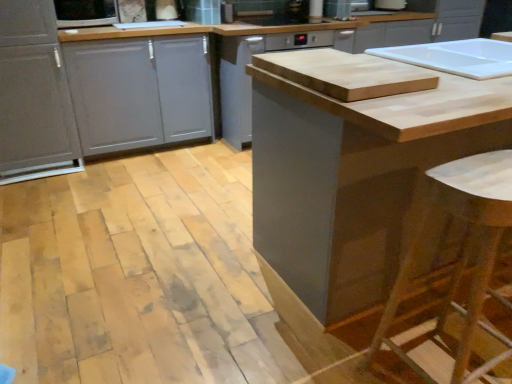
Question: Does wooden bar stool at lower right have a greater height compared to matte gray cabinet at center, which ranks as the 1th cabinetry in right-to-left order?

Choices:
 (A) no
 (B) yes

Answer: (A)

Question: Is the depth of wooden bar stool at lower right less than that of matte gray cabinet at center, which ranks as the 1th cabinetry in right-to-left order?

Choices:
 (A) no
 (B) yes

Answer: (B)

Question: Does wooden bar stool at lower right appear on the left side of matte gray cabinet at center, which ranks as the 1th cabinetry in right-to-left order?

Choices:
 (A) no
 (B) yes

Answer: (B)

Question: Considering the relative sizes of wooden bar stool at lower right and matte gray cabinet at center, which ranks as the 1th cabinetry in right-to-left order, in the image provided, is wooden bar stool at lower right smaller than matte gray cabinet at center, which ranks as the 1th cabinetry in right-to-left order,?

Choices:
 (A) yes
 (B) no

Answer: (A)

Question: Is wooden bar stool at lower right next to matte gray cabinet at center, which ranks as the 1th cabinetry in right-to-left order, and touching it?

Choices:
 (A) yes
 (B) no

Answer: (B)

Question: Is wooden bar stool at lower right oriented away from matte gray cabinet at center, the third cabinetry viewed from the left?

Choices:
 (A) yes
 (B) no

Answer: (B)

Question: Would you say wooden bar stool at lower right is a long distance from metallic silver dishwasher at upper center?

Choices:
 (A) yes
 (B) no

Answer: (A)

Question: Considering the relative sizes of wooden bar stool at lower right and metallic silver dishwasher at upper center in the image provided, is wooden bar stool at lower right smaller than metallic silver dishwasher at upper center?

Choices:
 (A) no
 (B) yes

Answer: (A)

Question: From the image's perspective, does wooden bar stool at lower right appear lower than metallic silver dishwasher at upper center?

Choices:
 (A) yes
 (B) no

Answer: (A)

Question: Could you tell me if wooden bar stool at lower right is facing metallic silver dishwasher at upper center?

Choices:
 (A) no
 (B) yes

Answer: (A)

Question: Considering the relative sizes of wooden bar stool at lower right and metallic silver dishwasher at upper center in the image provided, is wooden bar stool at lower right taller than metallic silver dishwasher at upper center?

Choices:
 (A) yes
 (B) no

Answer: (A)

Question: Considering the relative sizes of wooden bar stool at lower right and metallic silver dishwasher at upper center in the image provided, is wooden bar stool at lower right bigger than metallic silver dishwasher at upper center?

Choices:
 (A) no
 (B) yes

Answer: (B)

Question: Does natural wood cutting board at center appear on the left side of metallic silver dishwasher at upper center?

Choices:
 (A) no
 (B) yes

Answer: (B)